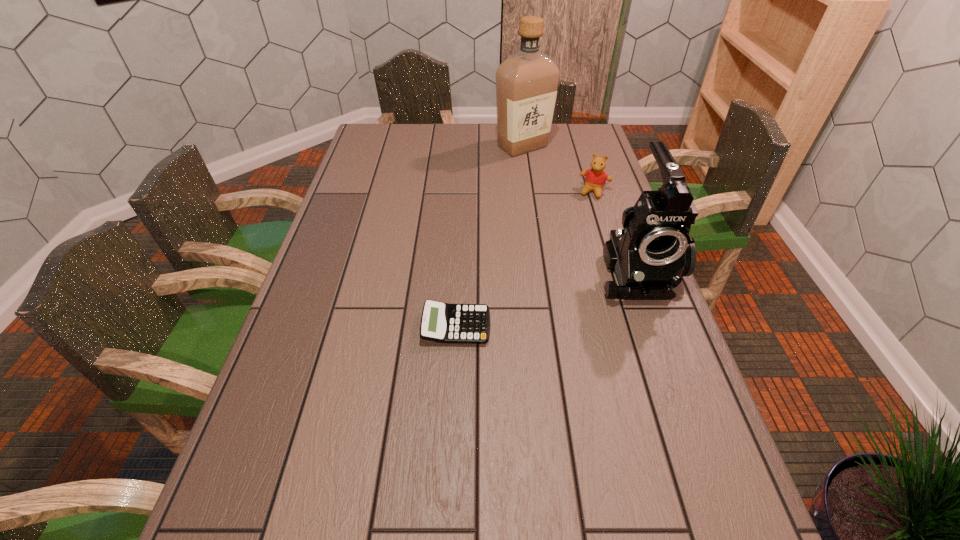
The height and width of the screenshot is (540, 960). Find the location of `free space on the desktop that is between the shortest object and the third shortest object and is positioned on the front-facing side of the farthest object`. free space on the desktop that is between the shortest object and the third shortest object and is positioned on the front-facing side of the farthest object is located at coordinates (534, 302).

Where is `free space on the desktop that is between the nearest object and the second nearest object and is positioned on the front-facing side of the second farthest object`? Image resolution: width=960 pixels, height=540 pixels. free space on the desktop that is between the nearest object and the second nearest object and is positioned on the front-facing side of the second farthest object is located at coordinates (556, 295).